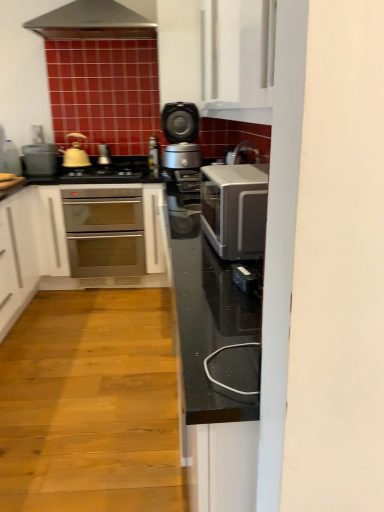
The height and width of the screenshot is (512, 384). I want to click on satin silver kettle at center, the 1th appliance positioned from the right, so click(x=103, y=155).

In order to face matte yellow tea pot at left, should I rotate leftwards or rightwards?

To face it directly, rotate left by 15.786 degrees.

What do you see at coordinates (40, 160) in the screenshot? I see `matte silver toaster at left, which is the first appliance from left to right` at bounding box center [40, 160].

Describe the element at coordinates (181, 136) in the screenshot. I see `satin silver cooker at center` at that location.

Where is `satin silver cooker at center`? The height and width of the screenshot is (512, 384). satin silver cooker at center is located at coordinates (181, 136).

Describe the element at coordinates (104, 232) in the screenshot. I see `stainless steel oven at center` at that location.

I want to click on satin silver gas stove at center, so [x=108, y=170].

Would you say stainless steel oven at center is to the left or to the right of satin silver gas stove at center in the picture?

From the image, it's evident that stainless steel oven at center is to the right of satin silver gas stove at center.

Is stainless steel oven at center oriented away from satin silver gas stove at center?

No, stainless steel oven at center's orientation is not away from satin silver gas stove at center.

Considering the sizes of objects stainless steel oven at center and satin silver gas stove at center in the image provided, who is smaller, stainless steel oven at center or satin silver gas stove at center?

Smaller between the two is satin silver gas stove at center.

Which object is wider, stainless steel oven at center or satin silver gas stove at center?

With larger width is stainless steel oven at center.

Considering the positions of objects satin silver gas stove at center and stainless steel oven at center in the image provided, who is in front, satin silver gas stove at center or stainless steel oven at center?

stainless steel oven at center.

Based on the photo, are satin silver gas stove at center and stainless steel oven at center far apart?

satin silver gas stove at center is actually quite close to stainless steel oven at center.

Is point (104, 166) less distant than point (96, 254)?

Yes.

Is satin silver gas stove at center at the left side of stainless steel oven at center?

Correct, you'll find satin silver gas stove at center to the left of stainless steel oven at center.

Considering the relative sizes of stainless steel oven at center and satin silver kettle at center, acting as the second appliance starting from the left, in the image provided, is stainless steel oven at center thinner than satin silver kettle at center, acting as the second appliance starting from the left,?

No.

From the picture: In terms of height, does stainless steel oven at center look taller or shorter compared to satin silver kettle at center, acting as the second appliance starting from the left?

Considering their sizes, stainless steel oven at center has more height than satin silver kettle at center, acting as the second appliance starting from the left.

Which point is more forward, (83, 261) or (103, 152)?

The point (83, 261) is closer.

Is stainless steel oven at center turned away from satin silver kettle at center, the 1th appliance positioned from the right?

No, satin silver kettle at center, the 1th appliance positioned from the right, is not at the back of stainless steel oven at center.

From the image's perspective, which is below, satin silver cooker at center or stainless steel oven at center?

stainless steel oven at center appears lower in the image.

Which is more to the right, satin silver cooker at center or stainless steel oven at center?

From the viewer's perspective, satin silver cooker at center appears more on the right side.

Is satin silver cooker at center positioned before stainless steel oven at center?

Yes, satin silver cooker at center is in front of stainless steel oven at center.

Which of these two, matte yellow tea pot at left or satin silver kettle at center, acting as the second appliance starting from the left, stands taller?

Standing taller between the two is matte yellow tea pot at left.

Considering the sizes of objects matte yellow tea pot at left and satin silver kettle at center, the 1th appliance positioned from the right, in the image provided, who is wider, matte yellow tea pot at left or satin silver kettle at center, the 1th appliance positioned from the right,?

Wider between the two is matte yellow tea pot at left.

Can you confirm if matte yellow tea pot at left is positioned to the left of satin silver kettle at center, acting as the second appliance starting from the left?

Indeed, matte yellow tea pot at left is positioned on the left side of satin silver kettle at center, acting as the second appliance starting from the left.

Considering the sizes of objects matte silver toaster at left, which appears as the 2th appliance when viewed from the right, and matte yellow tea pot at left in the image provided, who is taller, matte silver toaster at left, which appears as the 2th appliance when viewed from the right, or matte yellow tea pot at left?

matte yellow tea pot at left.

Is matte silver toaster at left, which appears as the 2th appliance when viewed from the right, inside the boundaries of matte yellow tea pot at left, or outside?

matte silver toaster at left, which appears as the 2th appliance when viewed from the right, is not enclosed by matte yellow tea pot at left.

Which is closer to the camera, (x=48, y=161) or (x=68, y=139)?

Point (x=48, y=161).

Looking at this image, does matte silver toaster at left, which appears as the 2th appliance when viewed from the right, have a greater width compared to matte yellow tea pot at left?

Indeed, matte silver toaster at left, which appears as the 2th appliance when viewed from the right, has a greater width compared to matte yellow tea pot at left.

Considering the points (56, 170) and (76, 173), which point is behind, point (56, 170) or point (76, 173)?

The point (56, 170) is more distant.

Is matte silver toaster at left, which appears as the 2th appliance when viewed from the right, oriented towards satin silver gas stove at center?

No, matte silver toaster at left, which appears as the 2th appliance when viewed from the right, is not facing towards satin silver gas stove at center.

Does matte silver toaster at left, which appears as the 2th appliance when viewed from the right, touch satin silver gas stove at center?

matte silver toaster at left, which appears as the 2th appliance when viewed from the right, and satin silver gas stove at center are clearly separated.

Locate an element on the screen. the 2nd appliance to the left when counting from the satin silver gas stove at center is located at coordinates (40, 160).

You are a GUI agent. You are given a task and a screenshot of the screen. Output one action in this format:
    pyautogui.click(x=<x>, y=<y>)
    Task: Click on the oven below the satin silver gas stove at center (from the image's perspective)
    This screenshot has width=384, height=512.
    Given the screenshot: What is the action you would take?
    pyautogui.click(x=104, y=232)

Identify the location of gas stove above the stainless steel oven at center (from a real-world perspective). This screenshot has width=384, height=512. (108, 170).

Considering their positions, is satin silver cooker at center positioned further to satin silver kettle at center, the 1th appliance positioned from the right, than satin silver toaster oven at center?

satin silver toaster oven at center is positioned further to the anchor satin silver kettle at center, the 1th appliance positioned from the right.

Estimate the real-world distances between objects in this image. Which object is further from matte yellow tea pot at left, satin silver gas stove at center or stainless steel oven at center?

stainless steel oven at center is positioned further to the anchor matte yellow tea pot at left.

Based on their spatial positions, is satin silver gas stove at center or stainless steel oven at center closer to satin silver kettle at center, acting as the second appliance starting from the left?

Based on the image, satin silver gas stove at center appears to be nearer to satin silver kettle at center, acting as the second appliance starting from the left.

Which object lies further to the anchor point satin silver kettle at center, the 1th appliance positioned from the right, satin silver toaster oven at center or matte yellow tea pot at left?

satin silver toaster oven at center is further to satin silver kettle at center, the 1th appliance positioned from the right.

When comparing their distances from stainless steel oven at center, does satin silver kettle at center, the 1th appliance positioned from the right, or satin silver cooker at center seem further?

satin silver cooker at center is further to stainless steel oven at center.

Considering their positions, is matte yellow tea pot at left positioned closer to satin silver toaster oven at center than matte silver toaster at left, which is the first appliance from left to right?

Based on the image, matte yellow tea pot at left appears to be nearer to satin silver toaster oven at center.

Estimate the real-world distances between objects in this image. Which object is closer to satin silver toaster oven at center, satin silver cooker at center or matte silver toaster at left, which is the first appliance from left to right?

Based on the image, satin silver cooker at center appears to be nearer to satin silver toaster oven at center.

Estimate the real-world distances between objects in this image. Which object is closer to stainless steel oven at center, satin silver toaster oven at center or satin silver gas stove at center?

satin silver gas stove at center.

Image resolution: width=384 pixels, height=512 pixels. Identify the location of appliance between satin silver toaster oven at center and satin silver kettle at center, acting as the second appliance starting from the left, along the z-axis. (40, 160).

The height and width of the screenshot is (512, 384). Identify the location of oven located between satin silver toaster oven at center and matte yellow tea pot at left in the depth direction. pos(104,232).

Where is `oven between satin silver toaster oven at center and satin silver gas stove at center along the z-axis`? Image resolution: width=384 pixels, height=512 pixels. oven between satin silver toaster oven at center and satin silver gas stove at center along the z-axis is located at coordinates (104, 232).

Where is `appliance located between matte silver toaster at left, which is the first appliance from left to right, and satin silver cooker at center in the left-right direction`? appliance located between matte silver toaster at left, which is the first appliance from left to right, and satin silver cooker at center in the left-right direction is located at coordinates (103, 155).